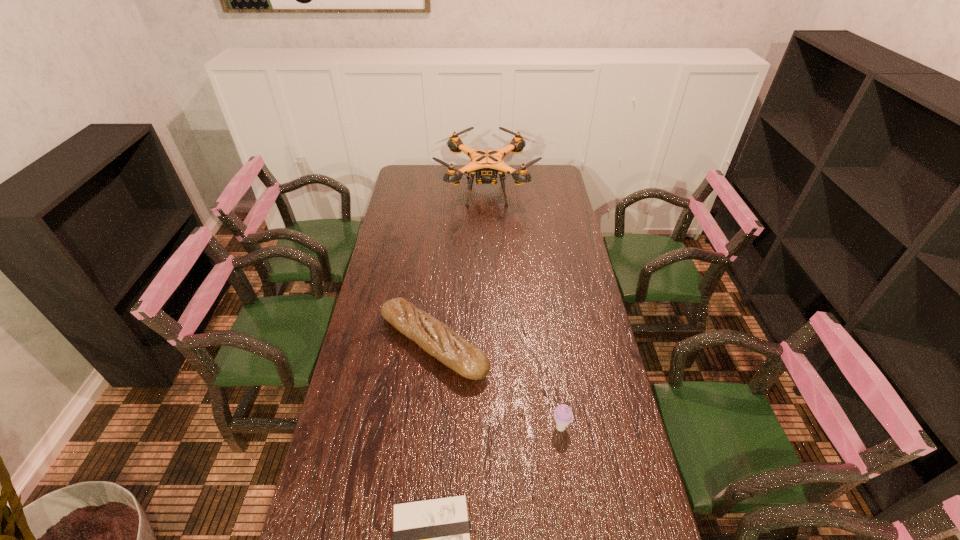
The height and width of the screenshot is (540, 960). What are the coordinates of `the farthest object` in the screenshot? It's located at (486, 163).

I want to click on the tallest object, so click(486, 163).

Where is `icecream`? The image size is (960, 540). icecream is located at coordinates (563, 416).

At what (x,y) coordinates should I click in order to perform the action: click on the second nearest object. Please return your answer as a coordinate pair (x, y). Image resolution: width=960 pixels, height=540 pixels. Looking at the image, I should click on (563, 416).

Where is `the second farthest object`? The height and width of the screenshot is (540, 960). the second farthest object is located at coordinates (438, 340).

Find the location of a particular element. The height and width of the screenshot is (540, 960). the third tallest object is located at coordinates (438, 340).

Image resolution: width=960 pixels, height=540 pixels. In order to click on vacant space located on the camera mount of the drone in this screenshot , I will do `click(420, 191)`.

The image size is (960, 540). In order to click on vacant space located 0.150m on the camera mount of the drone in this screenshot , I will do point(406,191).

The image size is (960, 540). Find the location of `free space located 0.100m on the camera mount of the drone`. free space located 0.100m on the camera mount of the drone is located at coordinates (417, 191).

Find the location of a particular element. vacant space situated on the front of the third farthest object is located at coordinates (569, 490).